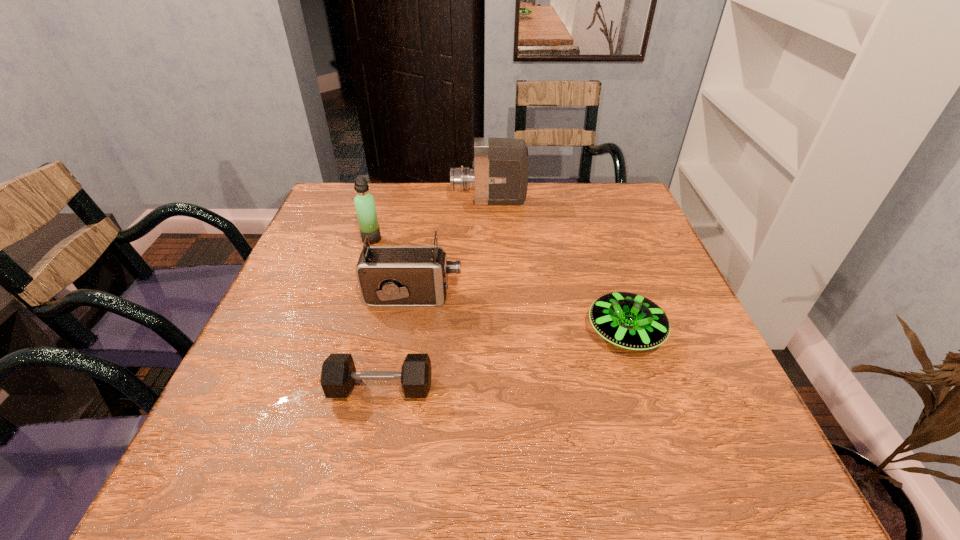
Find the location of a particular element. The image size is (960, 540). free spot located 0.080m on the left of the rightmost object is located at coordinates (548, 333).

Identify the location of free point located 0.190m on the right of the dumbbell. This screenshot has width=960, height=540. (536, 388).

Find the location of a particular element. object located in the far edge section of the desktop is located at coordinates (499, 175).

At what (x,y) coordinates should I click in order to perform the action: click on object located at the left edge. Please return your answer as a coordinate pair (x, y). This screenshot has width=960, height=540. Looking at the image, I should click on (364, 202).

Find the location of a particular element. This screenshot has width=960, height=540. object present at the right edge is located at coordinates click(x=627, y=320).

In the image, there is a desktop. In order to click on vacant space at the far edge in this screenshot , I will do `click(504, 223)`.

This screenshot has height=540, width=960. In the image, there is a desktop. Identify the location of blank space at the near edge. (339, 499).

This screenshot has height=540, width=960. I want to click on blank space at the left edge, so click(x=282, y=282).

The image size is (960, 540). I want to click on free space at the right edge of the desktop, so tap(651, 233).

Locate an element on the screen. The width and height of the screenshot is (960, 540). free space at the far left corner of the desktop is located at coordinates (312, 227).